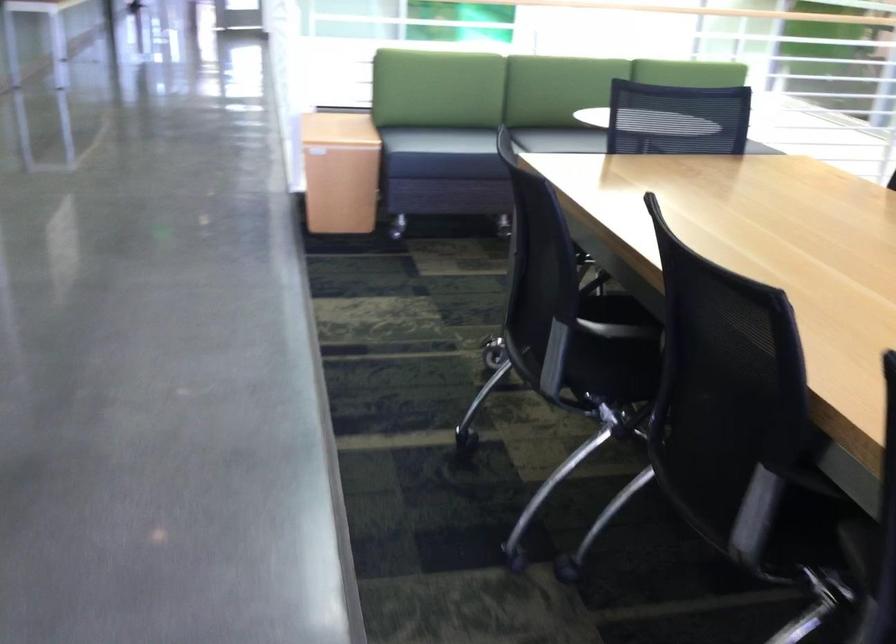
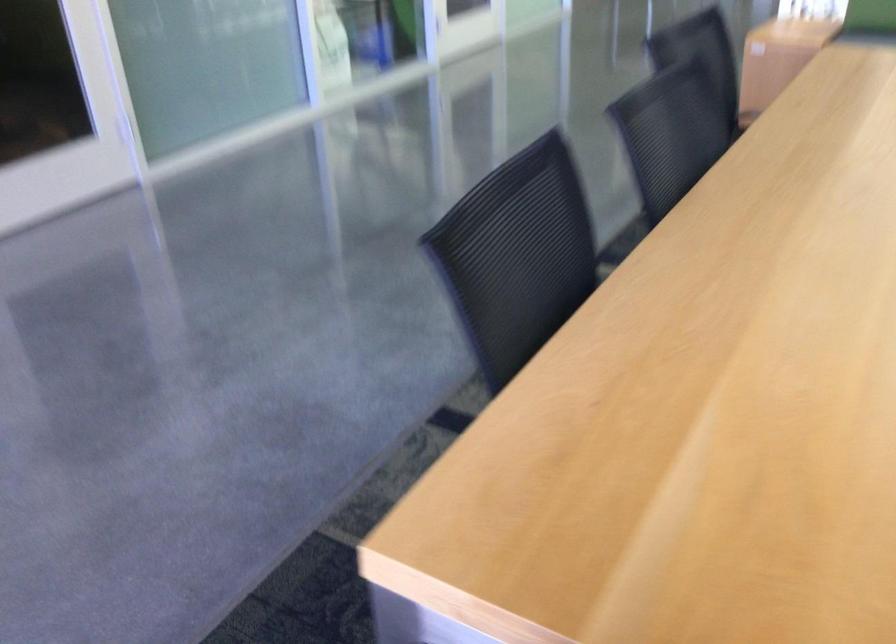
In the second image, find the point that corresponds to point 340,166 in the first image.

(778, 58)